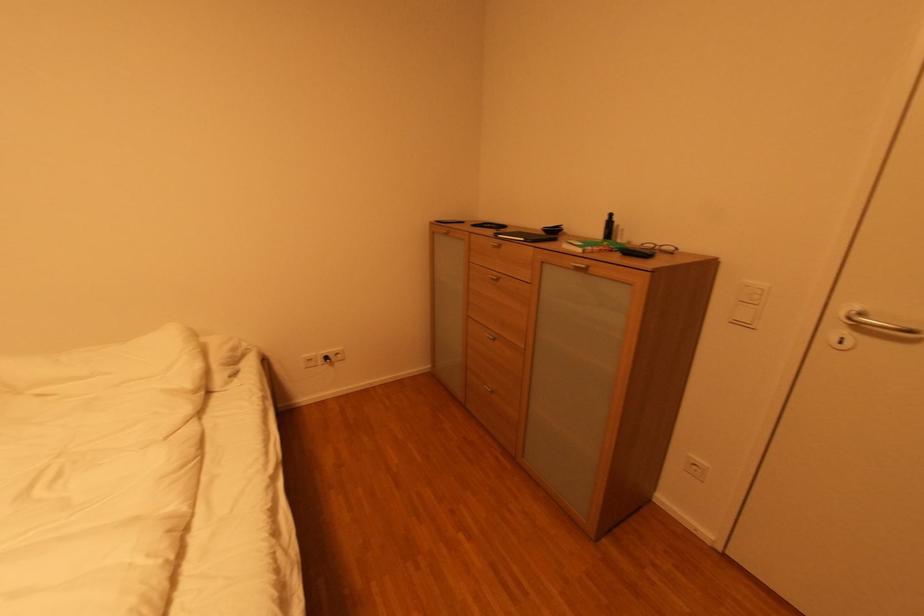
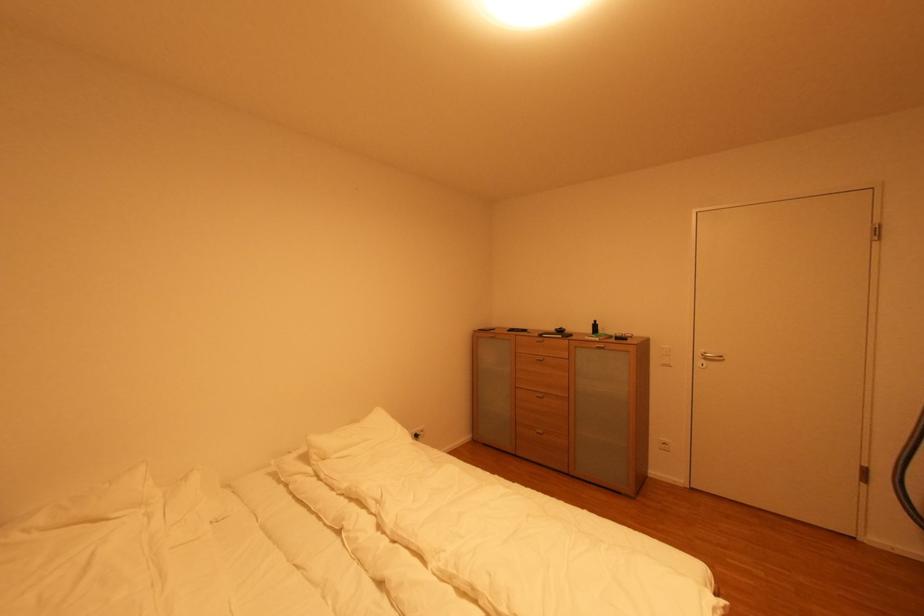
Locate, in the second image, the point that corresponds to the point at 499,281 in the first image.

(543, 361)